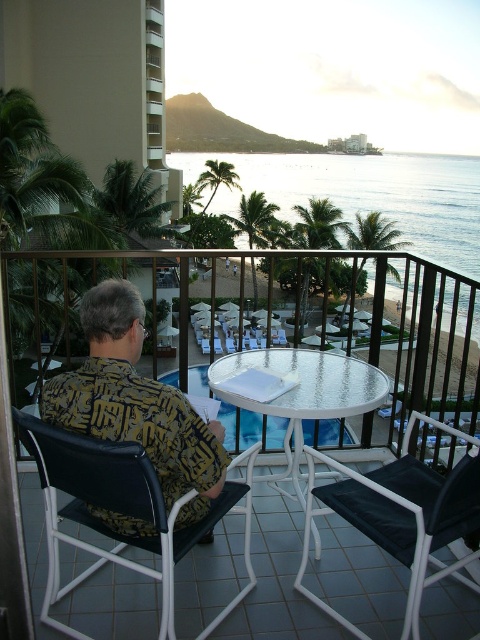
Question: Can you confirm if blue water at center is smaller than white textured glass table at center?

Choices:
 (A) yes
 (B) no

Answer: (B)

Question: Is yellow printed shirt at center further to camera compared to blue water at center?

Choices:
 (A) yes
 (B) no

Answer: (B)

Question: Which object is closer to the camera taking this photo?

Choices:
 (A) yellow printed shirt at center
 (B) white metal table at center
 (C) black fabric chair at lower left
 (D) beige concrete balcony at left

Answer: (B)

Question: Among these points, which one is farthest from the camera?

Choices:
 (A) (82, 404)
 (B) (474, 509)
 (C) (288, 220)
 (D) (37, 74)

Answer: (C)

Question: Which of these objects is positioned closest to the blue water at center?

Choices:
 (A) black fabric chair at lower right
 (B) black fabric chair at lower left
 (C) white textured glass table at center

Answer: (A)

Question: Is beige concrete balcony at left to the left of blue water at center from the viewer's perspective?

Choices:
 (A) no
 (B) yes

Answer: (B)